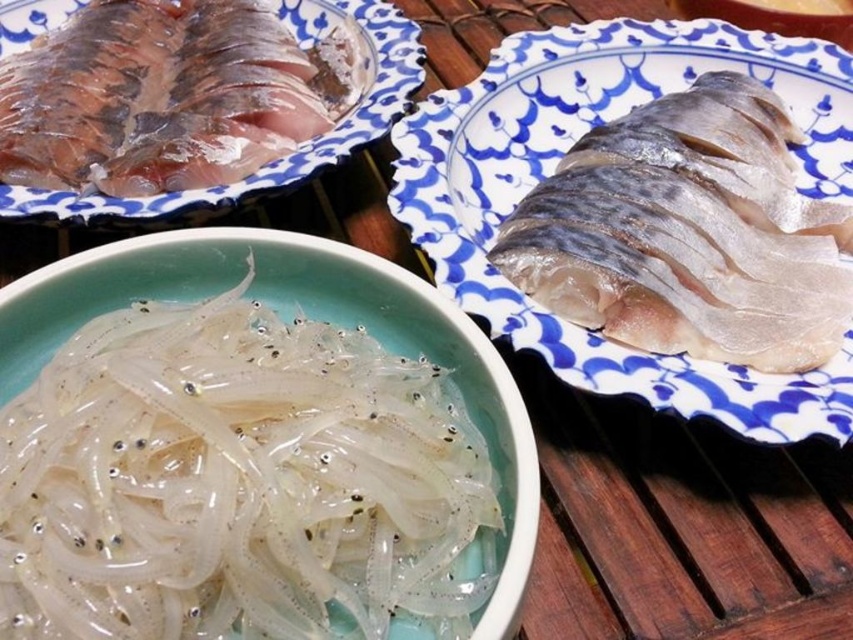
You are standing in front of the culinary presentation. There are two points marked in the scene. One is at coordinates point [454,321] and the other is at point [393,32]. Which point is closer to you?

Point [454,321] is in front of point [393,32], so the point at [454,321] is closer to you.